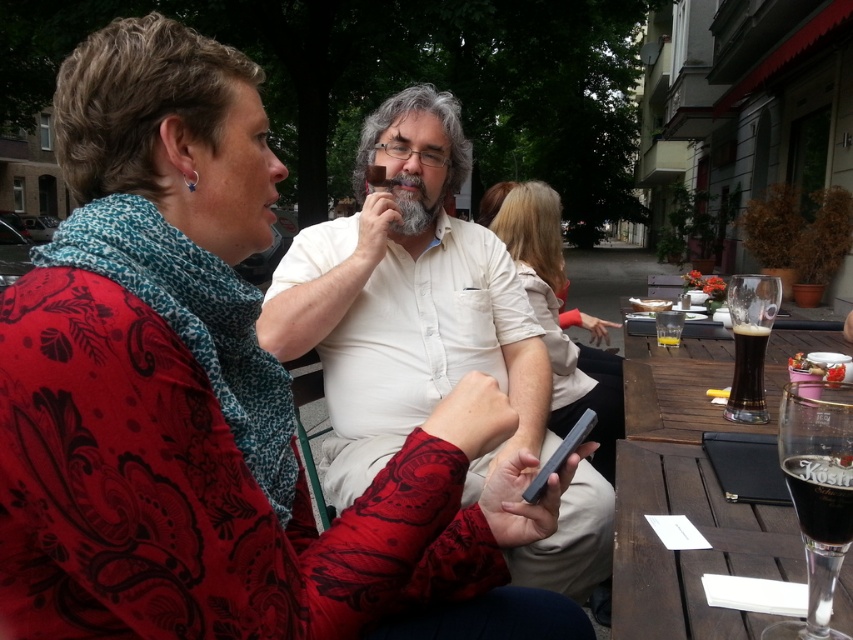
Question: Which object appears closest to the camera in this image?

Choices:
 (A) dark glass beer at table right
 (B) transparent glass at right
 (C) dark wood table at lower right

Answer: (C)

Question: Based on their relative distances, which object is farther from the transparent glass at right?

Choices:
 (A) white matte shirt at center
 (B) smooth beige blouse at center
 (C) dark brown glass at right
 (D) dark brown glass at lower right

Answer: (D)

Question: Considering the relative positions of clear glass beer at table right and transparent glass at right in the image provided, where is clear glass beer at table right located with respect to transparent glass at right?

Choices:
 (A) below
 (B) above

Answer: (A)

Question: Can you confirm if matte black phone at center is bigger than white matte shirt at center?

Choices:
 (A) yes
 (B) no

Answer: (B)

Question: Can you confirm if smooth beige blouse at center is wider than dark brown glass at lower right?

Choices:
 (A) yes
 (B) no

Answer: (A)

Question: Which point is farther to the camera?

Choices:
 (A) dark brown glass at right
 (B) white matte shirt at center
 (C) transparent glass at right
 (D) dark wood table at lower right

Answer: (A)